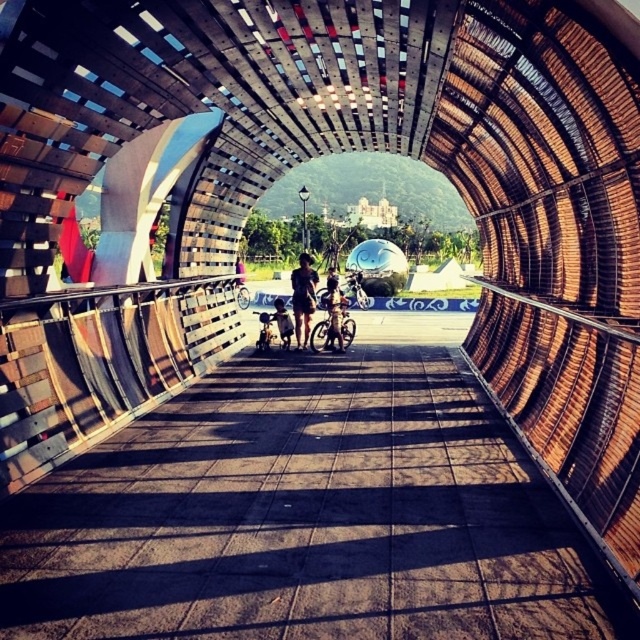
You are standing at the entrance of the tunnel and see the matte black bicycle at center. If you walk straight ahead, will you reach the bicycle before exiting the tunnel?

The position of matte black bicycle at center is at point (333,312), which is within the tunnel structure. Therefore, walking straight ahead will lead you to the bicycle before exiting the tunnel.

You are designing a layout for a childrens play area in the tunnel described. You need to place both the matte black bicycle at center and the silver metallic bicycle at center along the path. Given their sizes, which bicycle should you place closer to the entrance to ensure there is enough space for children to maneuver around them?

The matte black bicycle at center occupies less space than the silver metallic bicycle at center, so placing the silver metallic bicycle at center closer to the entrance would allow more space around it for children to maneuver.